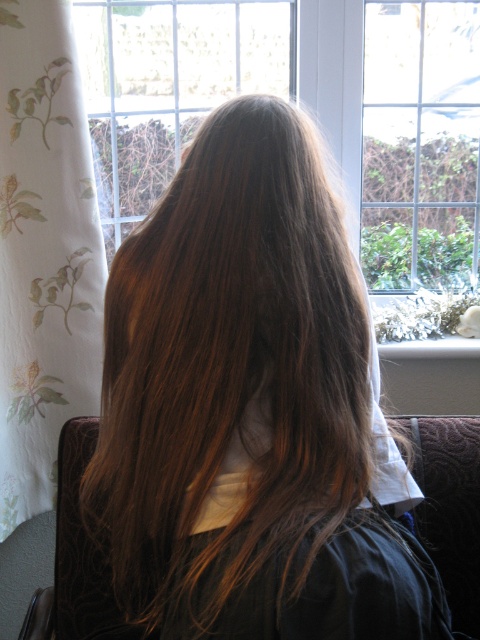
Question: Is brown silky hair at center smaller than floral-patterned fabric at left?

Choices:
 (A) no
 (B) yes

Answer: (A)

Question: Considering the real-world distances, which object is closest to the velvet brown chair at center?

Choices:
 (A) brown silky hair at center
 (B) floral-patterned fabric at left

Answer: (A)

Question: Can you confirm if brown silky hair at center is positioned to the left of floral-patterned fabric at left?

Choices:
 (A) yes
 (B) no

Answer: (B)

Question: Which point appears farthest from the camera in this image?

Choices:
 (A) (431, 493)
 (B) (21, 284)

Answer: (B)

Question: Can you confirm if floral-patterned fabric at left is positioned to the left of velvet brown chair at center?

Choices:
 (A) yes
 (B) no

Answer: (A)

Question: Among these points, which one is nearest to the camera?

Choices:
 (A) (144, 636)
 (B) (271, 416)

Answer: (B)